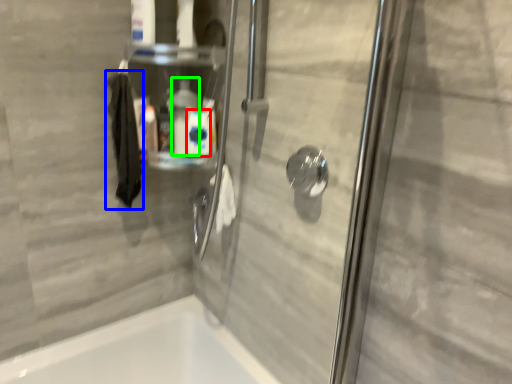
Question: Considering the real-world distances, which object is farthest from cleaning product (highlighted by a red box)? hand towel (highlighted by a blue box) or cleaning product (highlighted by a green box)?

Choices:
 (A) hand towel
 (B) cleaning product

Answer: (A)